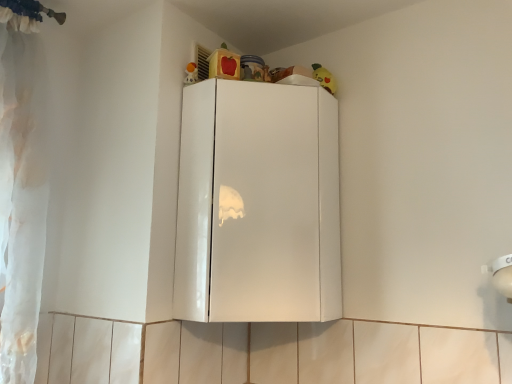
Question: Considering the relative sizes of matte plastic toy at upper center, arranged as the first toy when viewed from the left, and glossy white cabinet at upper center in the image provided, is matte plastic toy at upper center, arranged as the first toy when viewed from the left, smaller than glossy white cabinet at upper center?

Choices:
 (A) yes
 (B) no

Answer: (A)

Question: Would you say matte plastic toy at upper center, arranged as the first toy when viewed from the left, contains glossy white cabinet at upper center?

Choices:
 (A) yes
 (B) no

Answer: (B)

Question: From the image's perspective, is matte plastic toy at upper center, the 2th toy from the right, on top of glossy white cabinet at upper center?

Choices:
 (A) no
 (B) yes

Answer: (B)

Question: Is matte plastic toy at upper center, arranged as the 2th toy when viewed from the back, beside glossy white cabinet at upper center?

Choices:
 (A) no
 (B) yes

Answer: (A)

Question: Does matte plastic toy at upper center, arranged as the first toy when viewed from the left, come in front of glossy white cabinet at upper center?

Choices:
 (A) yes
 (B) no

Answer: (B)

Question: From the image's perspective, is yellow plush toy at upper right, which appears as the 2th toy when viewed from the front, positioned above or below glossy white cabinet at upper center?

Choices:
 (A) above
 (B) below

Answer: (A)

Question: Is yellow plush toy at upper right, which is the 1th toy from back to front, in front of or behind glossy white cabinet at upper center in the image?

Choices:
 (A) front
 (B) behind

Answer: (B)

Question: From a real-world perspective, is yellow plush toy at upper right, arranged as the 1th toy when viewed from the right, above or below glossy white cabinet at upper center?

Choices:
 (A) above
 (B) below

Answer: (A)

Question: Considering the positions of yellow plush toy at upper right, arranged as the 1th toy when viewed from the right, and glossy white cabinet at upper center in the image, is yellow plush toy at upper right, arranged as the 1th toy when viewed from the right, bigger or smaller than glossy white cabinet at upper center?

Choices:
 (A) small
 (B) big

Answer: (A)

Question: Is matte plastic toy at upper center, arranged as the 2th toy when viewed from the back, to the left or to the right of yellow plush toy at upper right, arranged as the 1th toy when viewed from the right, in the image?

Choices:
 (A) left
 (B) right

Answer: (A)

Question: From the image's perspective, is matte plastic toy at upper center, the 2th toy from the right, above or below yellow plush toy at upper right, arranged as the 2th toy when viewed from the left?

Choices:
 (A) below
 (B) above

Answer: (B)

Question: From a real-world perspective, is matte plastic toy at upper center, the 2th toy from the right, positioned above or below yellow plush toy at upper right, which appears as the 2th toy when viewed from the front?

Choices:
 (A) below
 (B) above

Answer: (A)

Question: Is matte plastic toy at upper center, arranged as the first toy when viewed from the left, in front of or behind yellow plush toy at upper right, arranged as the 2th toy when viewed from the left, in the image?

Choices:
 (A) front
 (B) behind

Answer: (A)

Question: Is glossy white cabinet at upper center in front of or behind yellow plush toy at upper right, arranged as the 2th toy when viewed from the left, in the image?

Choices:
 (A) front
 (B) behind

Answer: (A)

Question: Would you say glossy white cabinet at upper center is inside or outside yellow plush toy at upper right, arranged as the 1th toy when viewed from the right?

Choices:
 (A) outside
 (B) inside

Answer: (A)